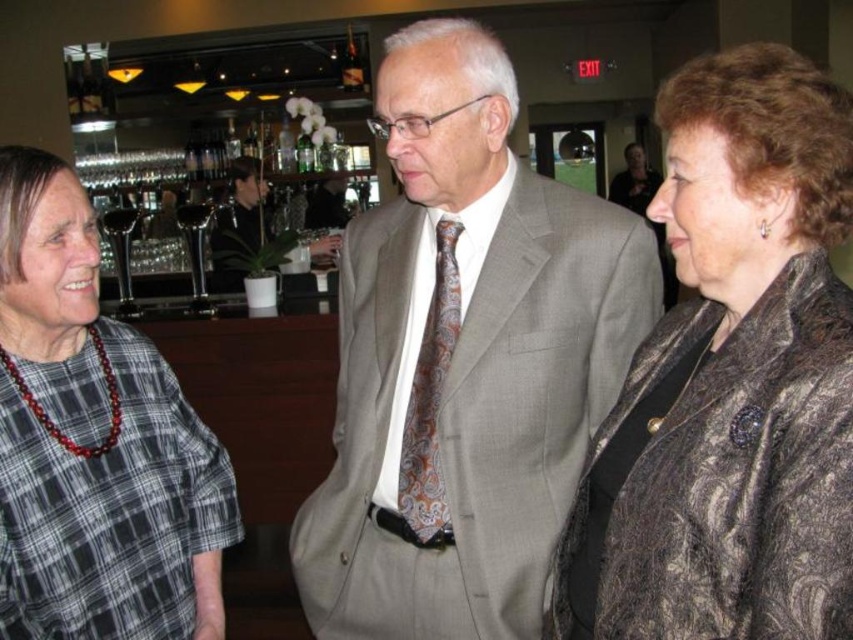
You are standing in the bar and want to move towards the point that is closer to you. Which point should you head towards, point (643, 362) or point (451, 339)?

Point (643, 362) is closer to the viewer than point (451, 339), so you should head towards point (643, 362).

You are standing in the bar and want to take a photo of both the point at coordinates [26,202] and the point at coordinates [439,524]. Which point should you focus on first to ensure both are in focus?

You should focus on the point at coordinates [26,202] first because it is closer to the camera than the point at coordinates [439,524]. This ensures that both points will be in focus when using a camera with a fixed focal length.